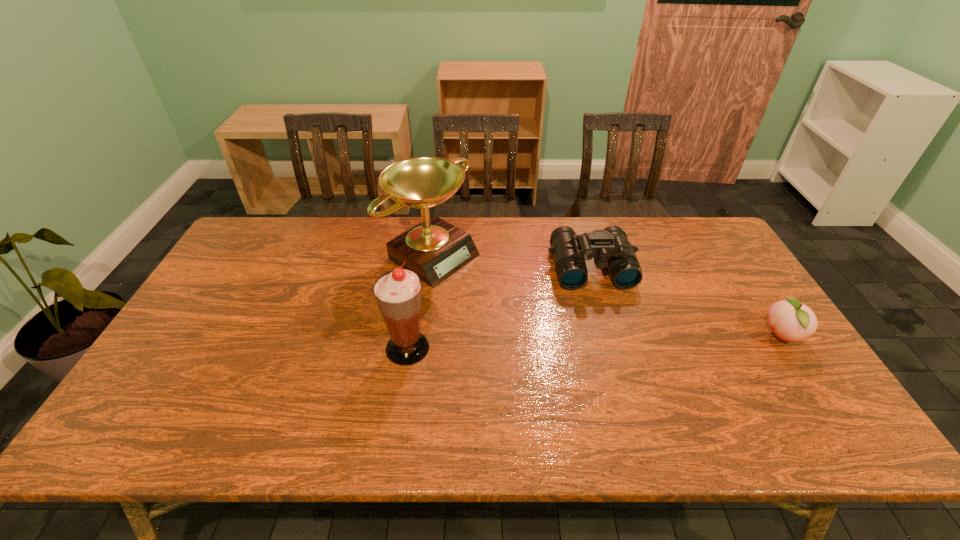
Locate an element on the screen. free space located through the lenses of the binoculars is located at coordinates (634, 407).

Locate an element on the screen. The width and height of the screenshot is (960, 540). vacant space situated on the front-facing side of the award is located at coordinates (502, 297).

Find the location of a particular element. This screenshot has height=540, width=960. vacant space located 0.060m on the front-facing side of the award is located at coordinates [482, 285].

You are a GUI agent. You are given a task and a screenshot of the screen. Output one action in this format:
    pyautogui.click(x=<x>, y=<y>)
    Task: Click on the vacant area situated on the front-facing side of the award
    Image resolution: width=960 pixels, height=540 pixels.
    Given the screenshot: What is the action you would take?
    pyautogui.click(x=539, y=319)

Find the location of `binoculars positioned at the far edge`. binoculars positioned at the far edge is located at coordinates (610, 248).

Where is `award at the far edge`? This screenshot has height=540, width=960. award at the far edge is located at coordinates (434, 249).

This screenshot has height=540, width=960. In order to click on object that is at the right edge in this screenshot , I will do point(792,321).

Identify the location of free region at the far edge. This screenshot has width=960, height=540. (531, 220).

Locate an element on the screen. free space at the near edge is located at coordinates (420, 388).

In the image, there is a desktop. Where is `free space at the left edge`? free space at the left edge is located at coordinates (231, 289).